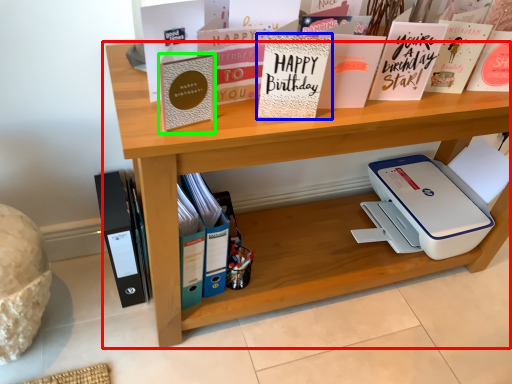
Question: Considering the real-world distances, which object is farthest from shelf (highlighted by a red box)? paperback book (highlighted by a blue box) or paperback book (highlighted by a green box)?

Choices:
 (A) paperback book
 (B) paperback book

Answer: (B)